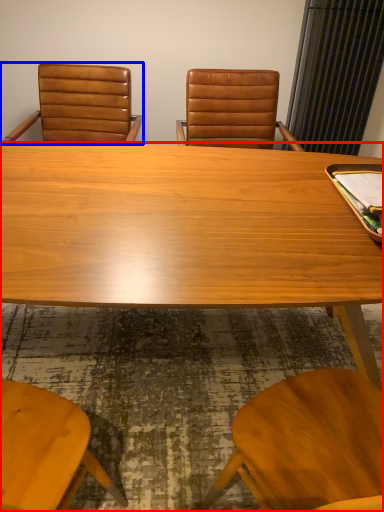
Question: Among these objects, which one is farthest to the camera, desk (highlighted by a red box) or chair (highlighted by a blue box)?

Choices:
 (A) desk
 (B) chair

Answer: (B)